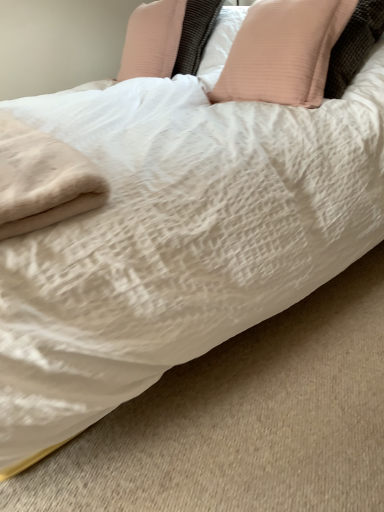
Question: From a real-world perspective, is pale pink fabric pillow at upper right, which ranks as the 2th pillow in left-to-right order, physically above pink ribbed pillow at upper center, acting as the second pillow starting from the right?

Choices:
 (A) yes
 (B) no

Answer: (B)

Question: Considering the relative positions of pale pink fabric pillow at upper right, which ranks as the 2th pillow in left-to-right order, and pink ribbed pillow at upper center, which ranks as the first pillow in left-to-right order, in the image provided, is pale pink fabric pillow at upper right, which ranks as the 2th pillow in left-to-right order, to the right of pink ribbed pillow at upper center, which ranks as the first pillow in left-to-right order, from the viewer's perspective?

Choices:
 (A) yes
 (B) no

Answer: (A)

Question: Can you confirm if pale pink fabric pillow at upper right, which ranks as the 2th pillow in left-to-right order, is shorter than pink ribbed pillow at upper center, which ranks as the first pillow in left-to-right order?

Choices:
 (A) no
 (B) yes

Answer: (A)

Question: Does pale pink fabric pillow at upper right, which ranks as the 2th pillow in left-to-right order, have a greater width compared to pink ribbed pillow at upper center, which ranks as the first pillow in left-to-right order?

Choices:
 (A) no
 (B) yes

Answer: (B)

Question: From the image's perspective, is pale pink fabric pillow at upper right, which ranks as the 2th pillow in left-to-right order, beneath pink ribbed pillow at upper center, which ranks as the first pillow in left-to-right order?

Choices:
 (A) yes
 (B) no

Answer: (A)

Question: Is pale pink fabric pillow at upper right, marked as the 1th pillow in a right-to-left arrangement, facing away from pink ribbed pillow at upper center, acting as the second pillow starting from the right?

Choices:
 (A) yes
 (B) no

Answer: (B)

Question: Is pink ribbed pillow at upper center, which ranks as the first pillow in left-to-right order, behind pale pink fabric pillow at upper right, marked as the 1th pillow in a right-to-left arrangement?

Choices:
 (A) yes
 (B) no

Answer: (A)

Question: Does pink ribbed pillow at upper center, acting as the second pillow starting from the right, have a greater width compared to pale pink fabric pillow at upper right, marked as the 1th pillow in a right-to-left arrangement?

Choices:
 (A) no
 (B) yes

Answer: (A)

Question: Would you say pale pink fabric pillow at upper right, which ranks as the 2th pillow in left-to-right order, is part of pink ribbed pillow at upper center, which ranks as the first pillow in left-to-right order,'s contents?

Choices:
 (A) yes
 (B) no

Answer: (B)

Question: From the image's perspective, is pink ribbed pillow at upper center, acting as the second pillow starting from the right, under pale pink fabric pillow at upper right, marked as the 1th pillow in a right-to-left arrangement?

Choices:
 (A) yes
 (B) no

Answer: (B)

Question: Can you confirm if pink ribbed pillow at upper center, acting as the second pillow starting from the right, is positioned to the left of pale pink fabric pillow at upper right, marked as the 1th pillow in a right-to-left arrangement?

Choices:
 (A) yes
 (B) no

Answer: (A)

Question: Can you confirm if pink ribbed pillow at upper center, acting as the second pillow starting from the right, is shorter than pale pink fabric pillow at upper right, which ranks as the 2th pillow in left-to-right order?

Choices:
 (A) no
 (B) yes

Answer: (B)

Question: Considering the positions of pale pink fabric pillow at upper right, marked as the 1th pillow in a right-to-left arrangement, and pink ribbed pillow at upper center, acting as the second pillow starting from the right, in the image, is pale pink fabric pillow at upper right, marked as the 1th pillow in a right-to-left arrangement, bigger or smaller than pink ribbed pillow at upper center, acting as the second pillow starting from the right,?

Choices:
 (A) big
 (B) small

Answer: (A)